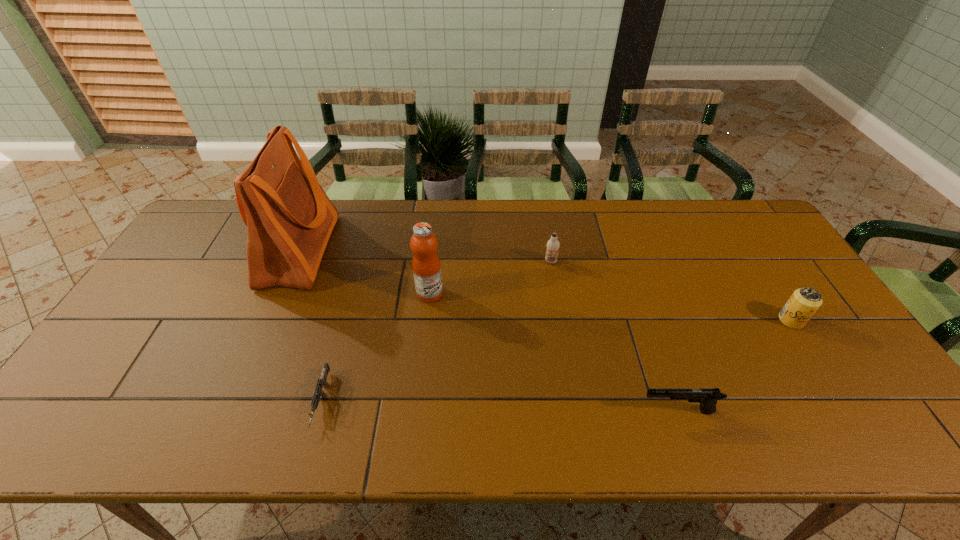
The width and height of the screenshot is (960, 540). What are the coordinates of `shopping bag` in the screenshot? It's located at (289, 218).

Locate an element on the screen. the tallest object is located at coordinates tap(289, 218).

You are a GUI agent. You are given a task and a screenshot of the screen. Output one action in this format:
    pyautogui.click(x=<x>, y=<y>)
    Task: Click on the fifth shortest object
    The width and height of the screenshot is (960, 540).
    Given the screenshot: What is the action you would take?
    pyautogui.click(x=426, y=265)

This screenshot has height=540, width=960. I want to click on fruit juice, so click(x=426, y=265).

The width and height of the screenshot is (960, 540). Find the location of `chocolate milk`. chocolate milk is located at coordinates (553, 244).

This screenshot has height=540, width=960. What are the coordinates of `the third nearest object` in the screenshot? It's located at click(x=804, y=302).

What are the coordinates of `beer can` in the screenshot? It's located at (804, 302).

At what (x,y) coordinates should I click in order to perform the action: click on the fifth tallest object. Please return your answer as a coordinate pair (x, y). The height and width of the screenshot is (540, 960). Looking at the image, I should click on (708, 398).

The image size is (960, 540). I want to click on the fifth object from left to right, so click(708, 398).

Image resolution: width=960 pixels, height=540 pixels. What are the coordinates of `the second object from left to right` in the screenshot? It's located at (321, 382).